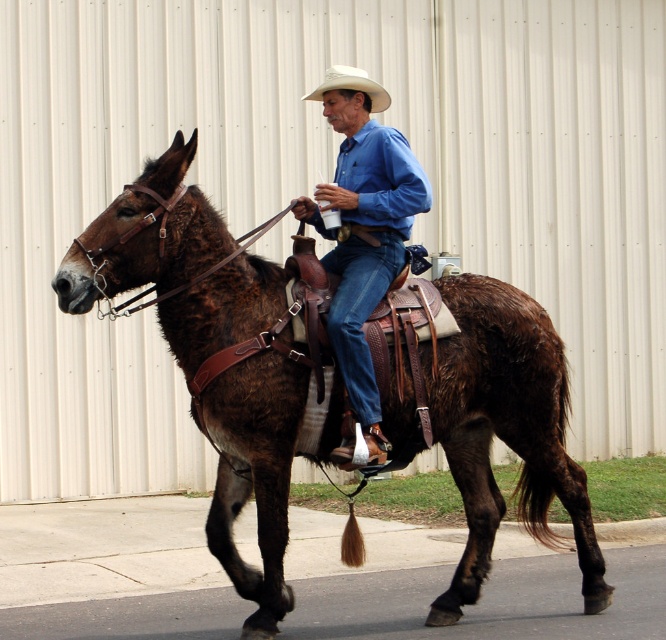
Which of these two, brown leather horse at center or white matte cowboy hat at center, stands shorter?

white matte cowboy hat at center is shorter.

Is point (262, 449) farther from viewer compared to point (356, 74)?

No.

Where is `brown leather horse at center`? brown leather horse at center is located at coordinates (505, 429).

Between point (348, 348) and point (378, 108), which one is positioned in front?

Positioned in front is point (348, 348).

Who is positioned more to the right, blue denim jeans at center or white matte cowboy hat at center?

blue denim jeans at center

Does point (344, 113) lie in front of point (322, 88)?

Yes.

You are a GUI agent. You are given a task and a screenshot of the screen. Output one action in this format:
    pyautogui.click(x=<x>, y=<y>)
    Task: Click on the blue denim jeans at center
    Image resolution: width=666 pixels, height=640 pixels.
    Given the screenshot: What is the action you would take?
    click(x=364, y=227)

Is point (165, 328) positioned behind point (374, 428)?

Yes, it is behind point (374, 428).

Which is in front, point (507, 392) or point (338, 205)?

Point (338, 205) is more forward.

The width and height of the screenshot is (666, 640). I want to click on brown leather horse at center, so click(505, 429).